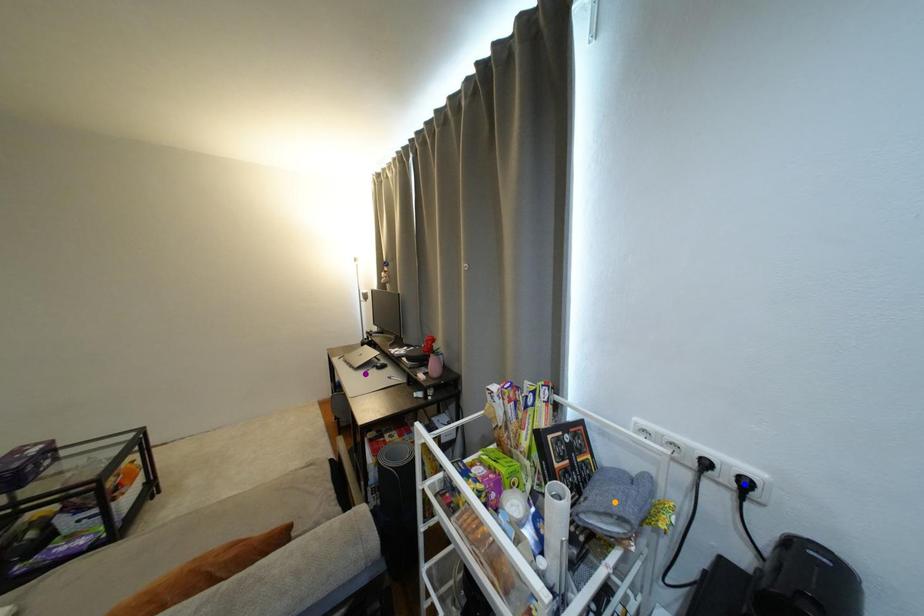
Order these from nearest to farthest:
1. orange point
2. purple point
3. blue point

blue point → orange point → purple point